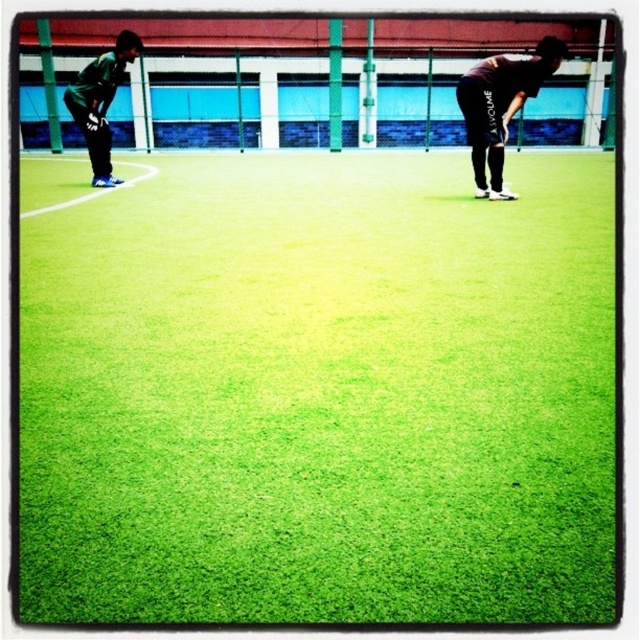
Which is more to the right, green artificial turf at center or dark green jersey at left?

green artificial turf at center is more to the right.

What do you see at coordinates (317, 392) in the screenshot?
I see `green artificial turf at center` at bounding box center [317, 392].

In order to click on green artificial turf at center in this screenshot , I will do [x=317, y=392].

Looking at this image, who is more forward, [492,65] or [134,51]?

Point [492,65]

Between point (499, 180) and point (97, 179), which one is positioned behind?

The point (97, 179) is behind.

This screenshot has width=640, height=640. Find the location of `black matte shirt at right`. black matte shirt at right is located at coordinates (500, 106).

Is green artificial turf at center positioned at the back of black matte shirt at right?

No, it is in front of black matte shirt at right.

Find the location of `green artificial turf at center`. green artificial turf at center is located at coordinates (317, 392).

Is point (528, 481) closer to camera compared to point (481, 68)?

Yes, point (528, 481) is in front of point (481, 68).

Identify the location of green artificial turf at center. The height and width of the screenshot is (640, 640). (317, 392).